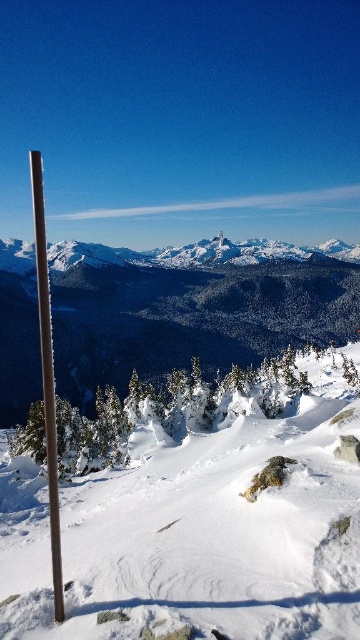
You are standing at the base of the wooden pole in the snow and want to walk towards the point marked as point (61, 262). Will you pass by point (293, 508) on your way there?

Yes, because point (293, 508) is in front of point (61, 262), so you will pass by point (293, 508) first before reaching point (61, 262).